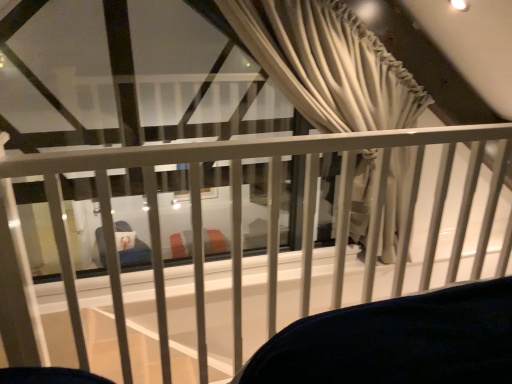
At what (x,y) coordinates should I click in order to perform the action: click on white fabric infant bed at center. Please return your answer as a coordinate pair (x, y). Looking at the image, I should click on (236, 228).

What do you see at coordinates (236, 228) in the screenshot?
I see `white fabric infant bed at center` at bounding box center [236, 228].

In order to click on white fabric infant bed at center in this screenshot , I will do `click(236, 228)`.